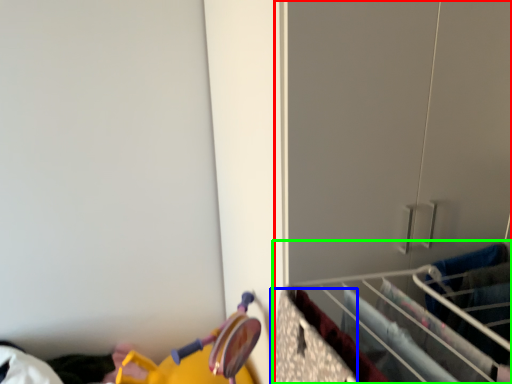
Question: Which object is the farthest from closet (highlighted by a red box)? Choose among these: drawer (highlighted by a blue box) or closet (highlighted by a green box).

Choices:
 (A) drawer
 (B) closet

Answer: (A)